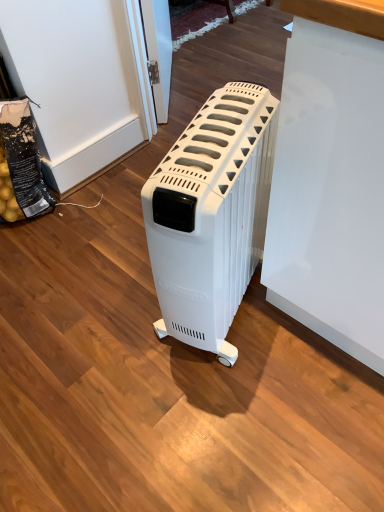
You are a GUI agent. You are given a task and a screenshot of the screen. Output one action in this format:
    pyautogui.click(x=<x>, y=<y>)
    Task: Click on the free spot above white plastic heater at center (from a real-world perspective)
    This screenshot has width=384, height=512.
    Given the screenshot: What is the action you would take?
    pyautogui.click(x=213, y=136)